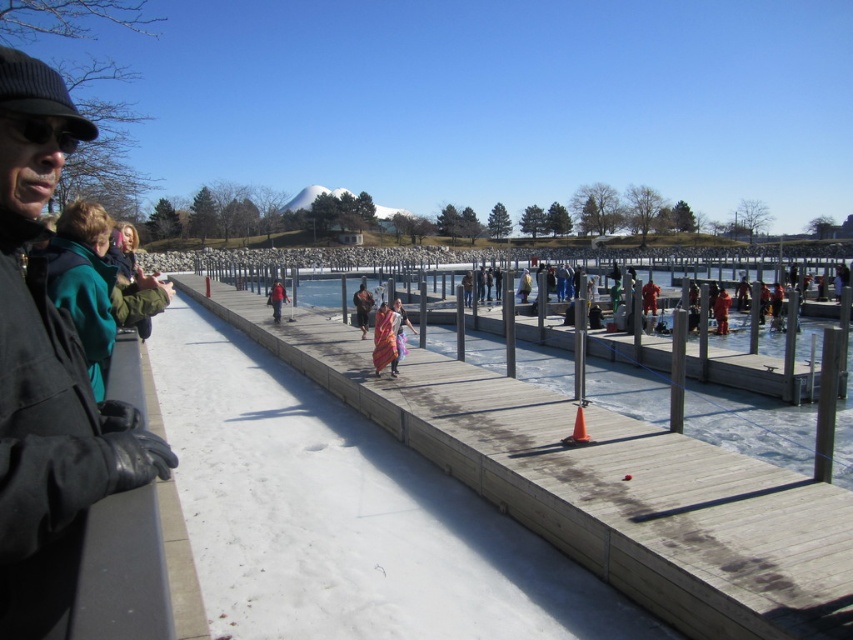
Question: Observing the image, what is the correct spatial positioning of black matte goggles at upper left in reference to red fabric person at center?

Choices:
 (A) below
 (B) above

Answer: (A)

Question: Which object is closer to the camera taking this photo?

Choices:
 (A) red fabric person at center
 (B) black woolen hat at upper left
 (C) black matte goggles at upper left

Answer: (B)

Question: Does green woolen jacket at left have a greater width compared to red fabric person at center?

Choices:
 (A) no
 (B) yes

Answer: (A)

Question: Which point is farther from the camera taking this photo?

Choices:
 (A) (39, 122)
 (B) (33, 74)
 (C) (65, 308)
 (D) (276, 284)

Answer: (D)

Question: Does black matte goggles at upper left appear over multicolored woven cloth at center?

Choices:
 (A) yes
 (B) no

Answer: (A)

Question: Which object appears farthest from the camera in this image?

Choices:
 (A) black woolen hat at upper left
 (B) black matte goggles at upper left

Answer: (B)